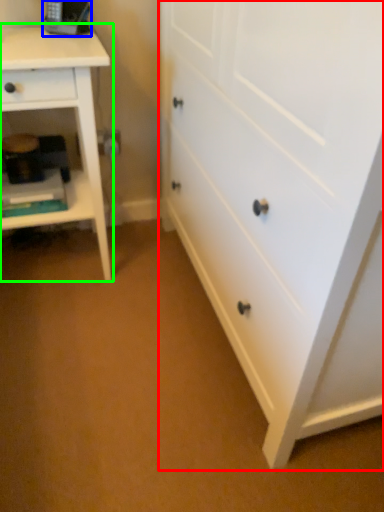
Question: Estimate the real-world distances between objects in this image. Which object is farther from chest of drawers (highlighted by a red box), equipment (highlighted by a blue box) or nightstand (highlighted by a green box)?

Choices:
 (A) equipment
 (B) nightstand

Answer: (A)